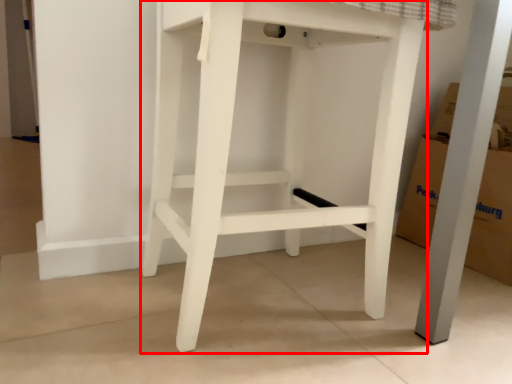
Question: Considering the relative positions of furniture (annotated by the red box) and cardboard box in the image provided, where is furniture (annotated by the red box) located with respect to the staircase?

Choices:
 (A) right
 (B) left

Answer: (B)